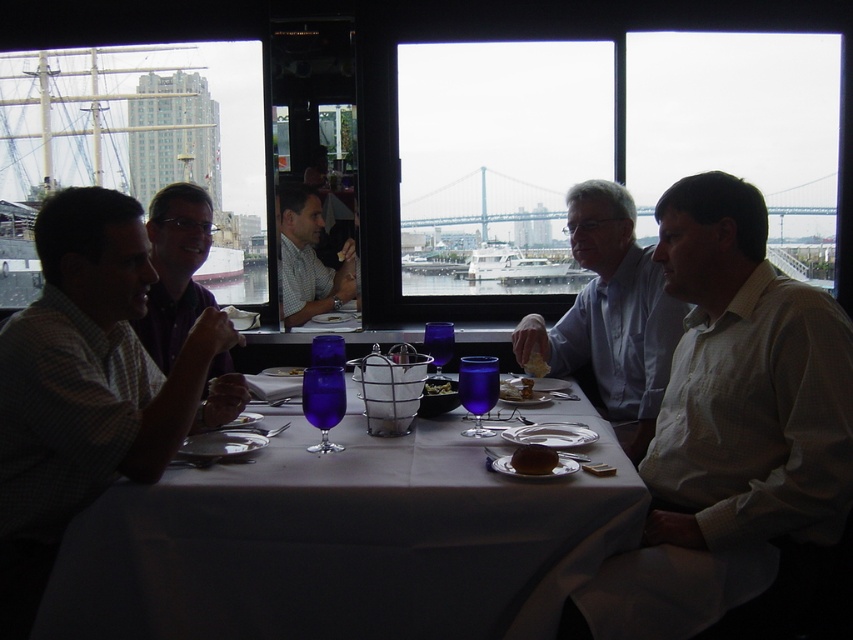
Which is below, white checkered shirt at right or matte white shirt at center?

white checkered shirt at right

Does white checkered shirt at right have a lesser width compared to matte white shirt at center?

Incorrect, white checkered shirt at right's width is not less than matte white shirt at center's.

Is point (842, 376) closer to camera compared to point (282, 205)?

Yes, point (842, 376) is closer to viewer.

I want to click on white checkered shirt at right, so click(x=733, y=436).

Is point (643, 440) positioned before point (502, 397)?

No, it is not.

Can you confirm if white shirt at right is taller than spongy yellow bread at center?

Yes.

Is point (633, 339) more distant than point (505, 397)?

Yes, point (633, 339) is behind point (505, 397).

This screenshot has width=853, height=640. What are the coordinates of `white shirt at right` in the screenshot? It's located at (611, 314).

Does matte purple shirt at center appear on the left side of smooth brown bread at center?

Yes, matte purple shirt at center is to the left of smooth brown bread at center.

Does matte purple shirt at center have a larger size compared to smooth brown bread at center?

Yes, matte purple shirt at center is bigger than smooth brown bread at center.

Where is `matte purple shirt at center`? Image resolution: width=853 pixels, height=640 pixels. matte purple shirt at center is located at coordinates (175, 269).

Find the location of `matte purple shirt at center`. matte purple shirt at center is located at coordinates (175, 269).